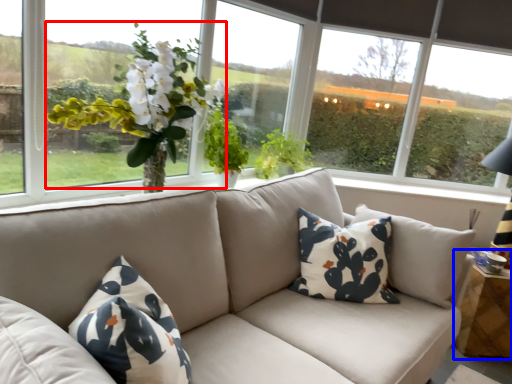
Question: Which object is closer to the camera taking this photo, floral arrangement (highlighted by a red box) or table (highlighted by a blue box)?

Choices:
 (A) floral arrangement
 (B) table

Answer: (A)